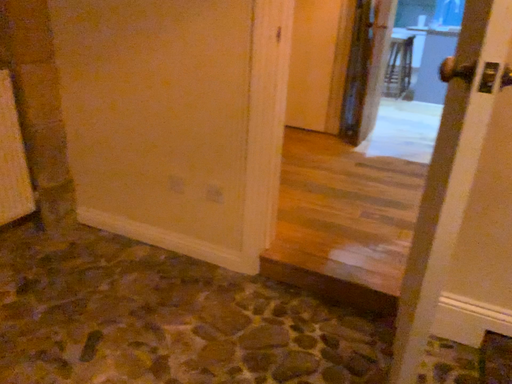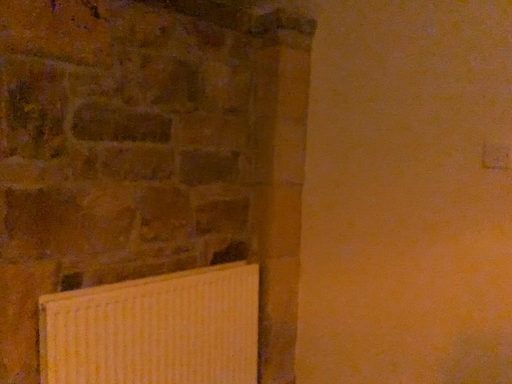
Question: Which way did the camera rotate in the video?

Choices:
 (A) rotated left
 (B) rotated right

Answer: (A)